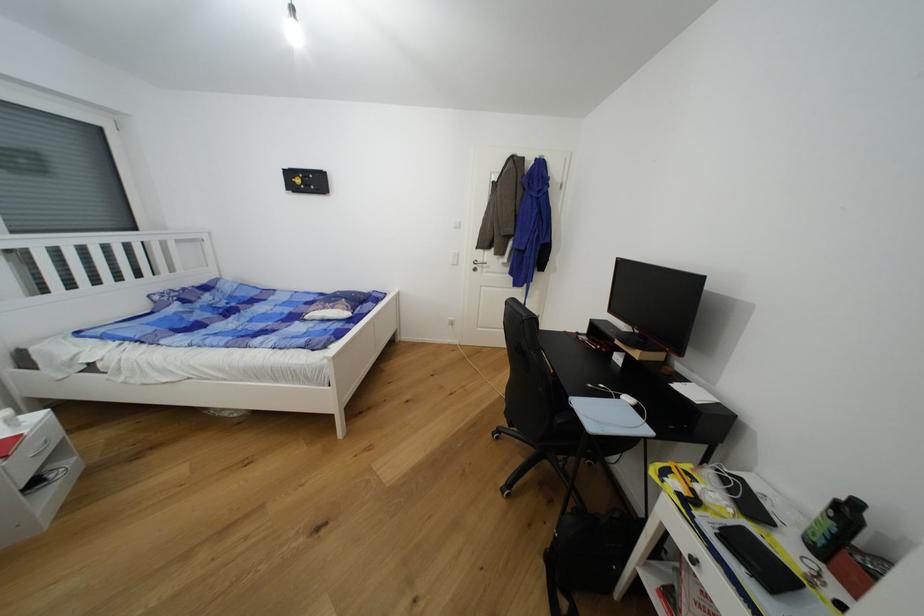
Find the location of a particular element. This screenshot has width=924, height=616. black plastic bottle is located at coordinates (834, 527).